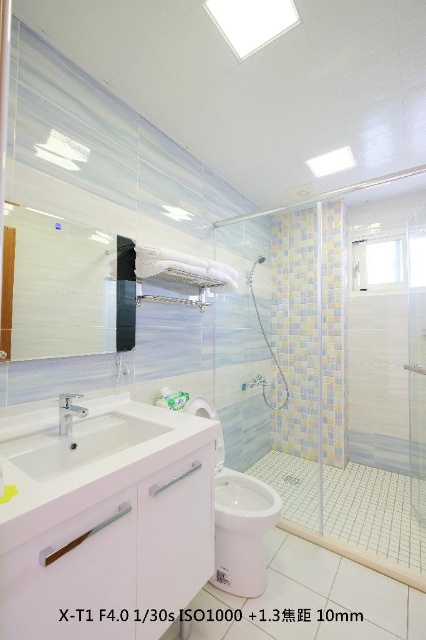
Question: Is transparent glass shower door at right smaller than white glossy sink at lower left?

Choices:
 (A) yes
 (B) no

Answer: (B)

Question: Which object is farther from the camera taking this photo?

Choices:
 (A) white glossy tile at lower right
 (B) white glossy sink at lower left
 (C) transparent glass shower door at right
 (D) white glossy tile at center

Answer: (C)

Question: Is transparent glass shower door at right below white glossy tile at lower right?

Choices:
 (A) no
 (B) yes

Answer: (A)

Question: Among these points, which one is farthest from the camera?

Choices:
 (A) (377, 490)
 (B) (256, 262)
 (C) (244, 593)

Answer: (B)

Question: Does white glossy toilet bowl at lower center appear on the left side of white glossy tile at center?

Choices:
 (A) yes
 (B) no

Answer: (A)

Question: Which point is closer to the camera?

Choices:
 (A) (239, 547)
 (B) (114, 433)

Answer: (B)